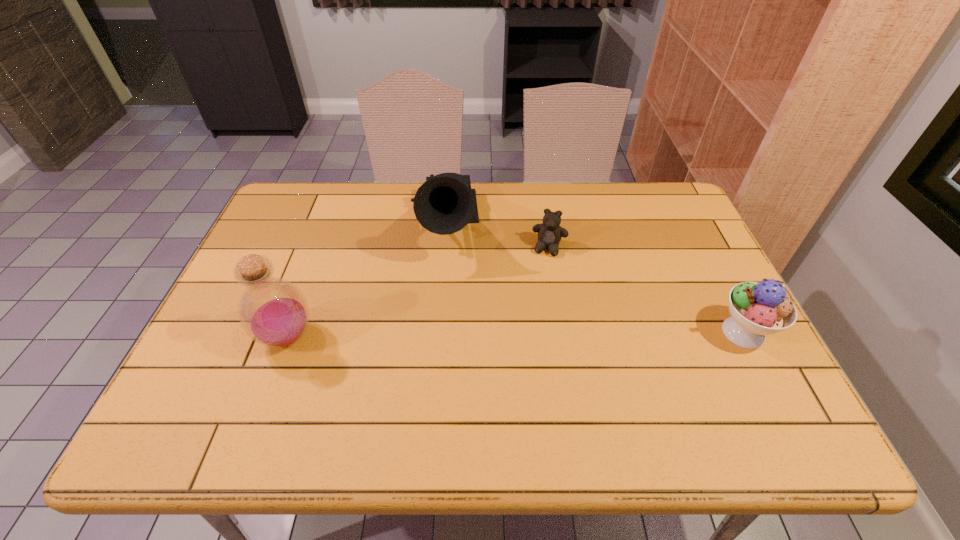
I want to click on vacant space on the desktop that is between the leftmost object and the second shortest object and is positioned on the face of the shortest object, so click(529, 335).

Image resolution: width=960 pixels, height=540 pixels. Find the location of `vacant spot on the desktop that is between the bottle and the rightmost object and is positioned from the horn of the second object from left to right`. vacant spot on the desktop that is between the bottle and the rightmost object and is positioned from the horn of the second object from left to right is located at coordinates (448, 335).